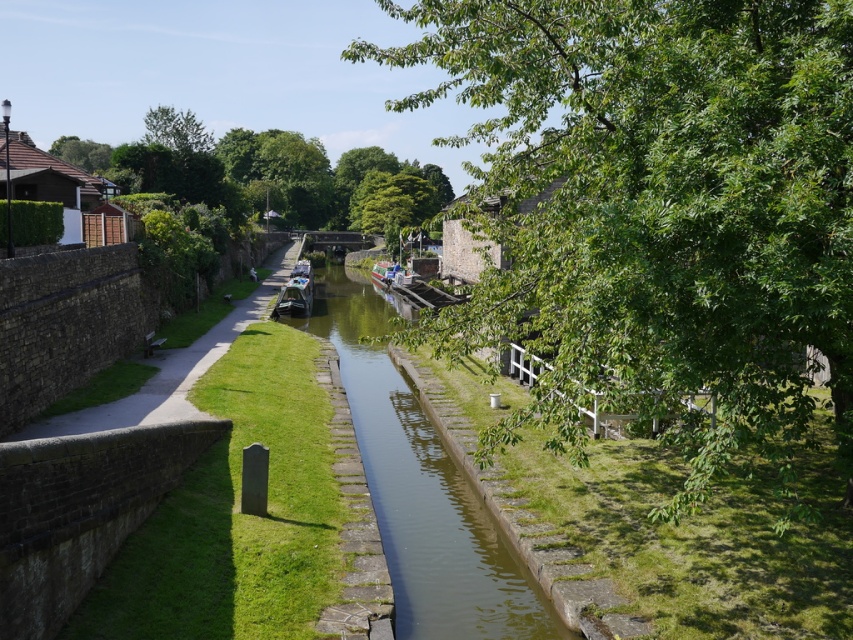
You are standing at the edge of the canal and want to take a photo of the green leafy tree at upper center. If your camera has a maximum zoom range of 50 meters, will you be able to capture the tree clearly without moving closer?

The green leafy tree at upper center is 62.23 meters away from the viewer. Since the camera can only zoom up to 50 meters, you won cannot capture the tree clearly without moving closer.